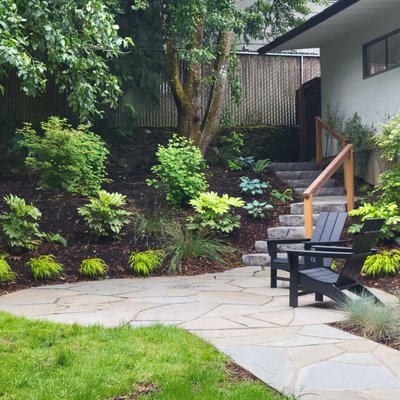
The image size is (400, 400). In order to click on wall of house in this screenshot , I will do `click(347, 72)`.